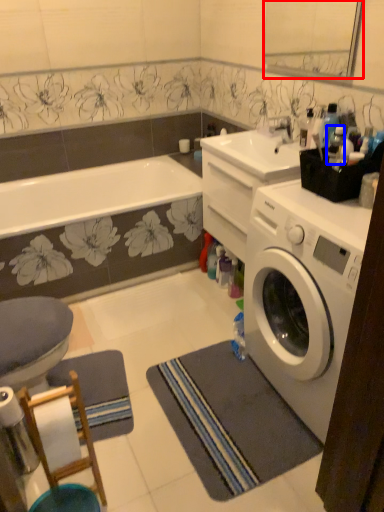
Question: Among these objects, which one is farthest to the camera, mirror (highlighted by a red box) or bottle (highlighted by a blue box)?

Choices:
 (A) mirror
 (B) bottle

Answer: (A)